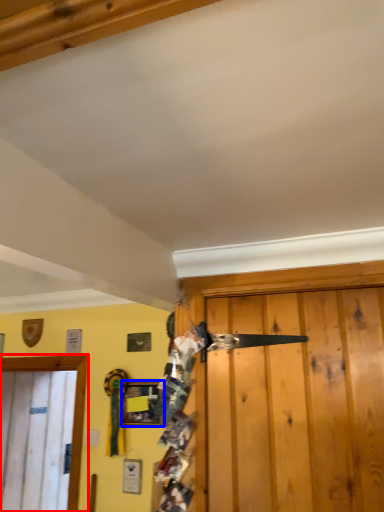
Question: Among these objects, which one is nearest to the camera, door (highlighted by a red box) or picture frame (highlighted by a blue box)?

Choices:
 (A) door
 (B) picture frame

Answer: (B)